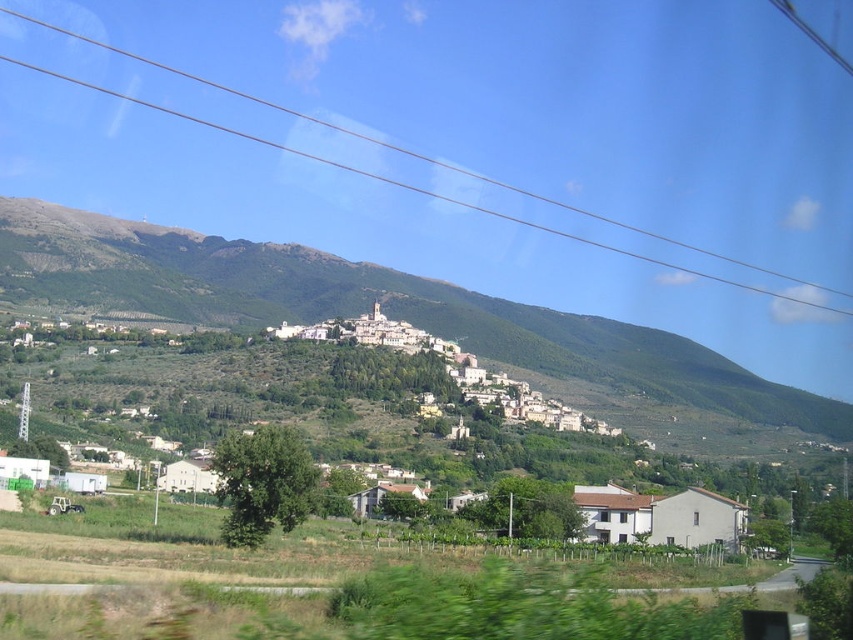
Who is positioned more to the right, green grassy hillside at upper center or transparent glass power lines at upper center?

From the viewer's perspective, transparent glass power lines at upper center appears more on the right side.

In the scene shown: Is green grassy hillside at upper center behind transparent glass power lines at upper center?

That is False.

Is point (341, 308) positioned in front of point (0, 10)?

Yes, it is.

The width and height of the screenshot is (853, 640). Find the location of `green grassy hillside at upper center`. green grassy hillside at upper center is located at coordinates (407, 321).

Who is lower down, white stone village at center or transparent glass power lines at upper center?

Positioned lower is white stone village at center.

Which of these two, white stone village at center or transparent glass power lines at upper center, stands taller?

transparent glass power lines at upper center

This screenshot has height=640, width=853. What do you see at coordinates (451, 369) in the screenshot?
I see `white stone village at center` at bounding box center [451, 369].

Find the location of `white stone village at center`. white stone village at center is located at coordinates (451, 369).

Does green grassy hillside at upper center have a greater height compared to white stone village at center?

Yes.

Can you confirm if green grassy hillside at upper center is shorter than white stone village at center?

No.

Does point (845, 435) come farther from viewer compared to point (315, 337)?

Yes.

This screenshot has width=853, height=640. I want to click on green grassy hillside at upper center, so click(407, 321).